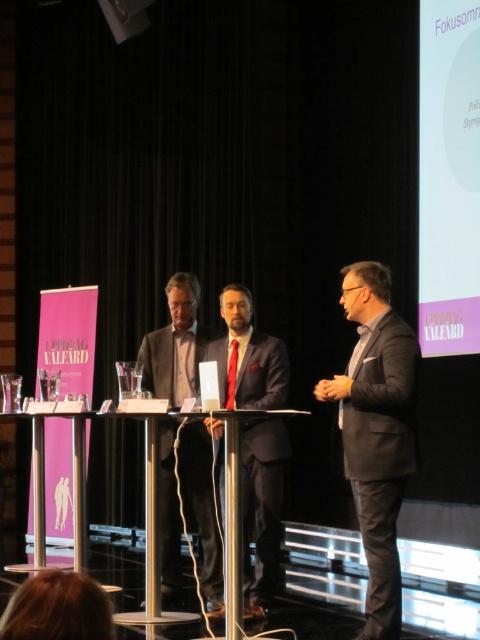
Question: Among these objects, which one is nearest to the camera?

Choices:
 (A) dark gray suit at right
 (B) dark gray wool suit at center
 (C) matte black suit at center

Answer: (A)

Question: Is dark gray suit at right to the left of dark gray wool suit at center from the viewer's perspective?

Choices:
 (A) no
 (B) yes

Answer: (A)

Question: Is dark gray suit at right thinner than dark gray wool suit at center?

Choices:
 (A) yes
 (B) no

Answer: (A)

Question: Which point is farther to the camera?

Choices:
 (A) (245, 396)
 (B) (412, 444)
 (C) (180, 438)

Answer: (C)

Question: Is matte black suit at center bigger than dark gray wool suit at center?

Choices:
 (A) no
 (B) yes

Answer: (A)

Question: Which of the following is the closest to the observer?

Choices:
 (A) dark gray wool suit at center
 (B) matte black suit at center
 (C) dark gray suit at right

Answer: (C)